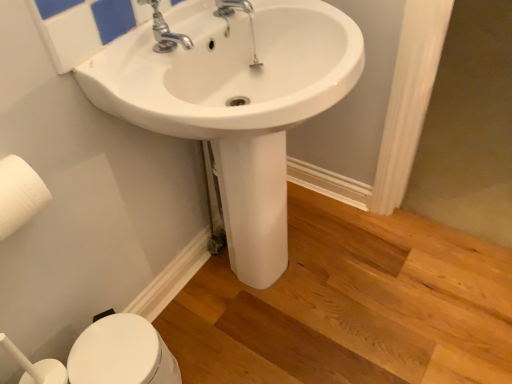
Identify the location of vacant space positioned to the left of polished chrome faucet at upper center. The height and width of the screenshot is (384, 512). (130, 66).